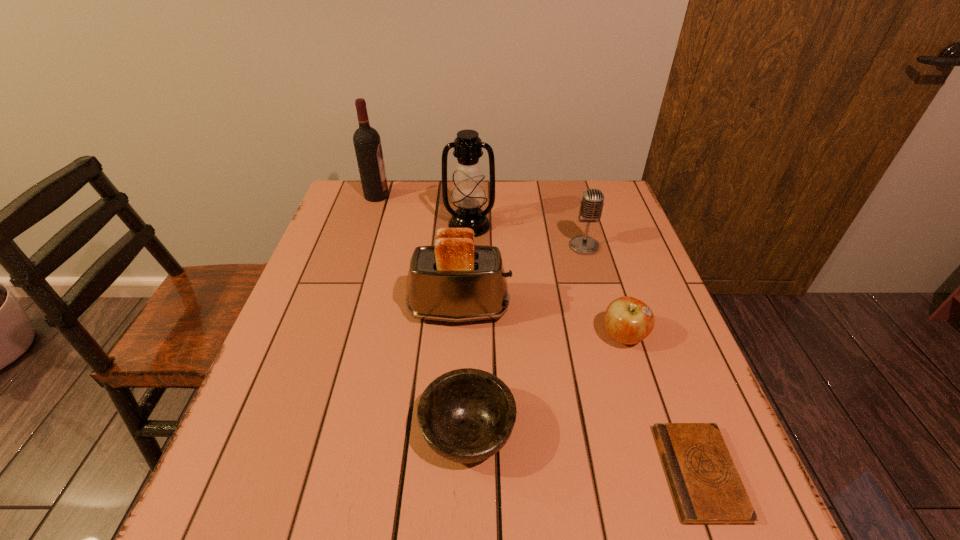
Image resolution: width=960 pixels, height=540 pixels. Find the location of `object that is at the left edge`. object that is at the left edge is located at coordinates (367, 143).

The image size is (960, 540). Find the location of `microphone that is at the right edge`. microphone that is at the right edge is located at coordinates (591, 206).

In order to click on apple located in the right edge section of the desktop in this screenshot , I will do `click(628, 320)`.

You are a GUI agent. You are given a task and a screenshot of the screen. Output one action in this format:
    pyautogui.click(x=<x>, y=<y>)
    Task: Click on the diary positioned at the right edge
    Image resolution: width=960 pixels, height=540 pixels.
    Given the screenshot: What is the action you would take?
    pyautogui.click(x=707, y=488)

Where is `object present at the far left corner`? This screenshot has height=540, width=960. object present at the far left corner is located at coordinates [367, 143].

At what (x,y) coordinates should I click in order to perform the action: click on object that is at the near right corner. Please return your answer as a coordinate pair (x, y). The width and height of the screenshot is (960, 540). Looking at the image, I should click on (707, 488).

This screenshot has height=540, width=960. Identify the location of vacant space at the far edge of the desktop. (496, 211).

Identify the location of vacant space at the near edge of the desktop. This screenshot has width=960, height=540. (549, 535).

Identify the location of vacant region at the left edge of the desktop. The height and width of the screenshot is (540, 960). (338, 329).

Image resolution: width=960 pixels, height=540 pixels. In the image, there is a desktop. Identify the location of vacant space at the right edge. tap(610, 344).